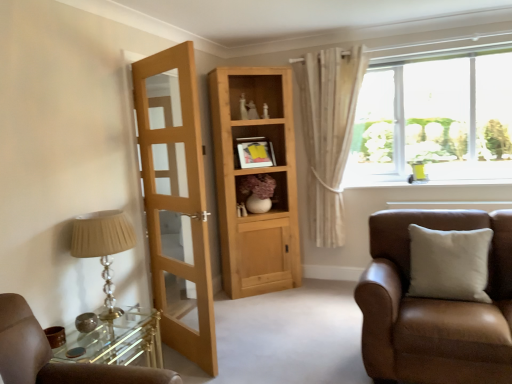
Question: Considering the relative sizes of light brown wooden door at left and white glossy window sill at upper right in the image provided, is light brown wooden door at left wider than white glossy window sill at upper right?

Choices:
 (A) no
 (B) yes

Answer: (A)

Question: Is light brown wooden door at left located outside white glossy window sill at upper right?

Choices:
 (A) yes
 (B) no

Answer: (A)

Question: Can you confirm if light brown wooden door at left is thinner than white glossy window sill at upper right?

Choices:
 (A) no
 (B) yes

Answer: (B)

Question: Is light brown wooden door at left facing towards white glossy window sill at upper right?

Choices:
 (A) no
 (B) yes

Answer: (A)

Question: Is light brown wooden door at left far away from white glossy window sill at upper right?

Choices:
 (A) no
 (B) yes

Answer: (B)

Question: From the image's perspective, is brown leather chair at right located above or below white glossy window sill at upper right?

Choices:
 (A) below
 (B) above

Answer: (A)

Question: From a real-world perspective, is brown leather chair at right physically located above or below white glossy window sill at upper right?

Choices:
 (A) below
 (B) above

Answer: (A)

Question: In terms of width, does brown leather chair at right look wider or thinner when compared to white glossy window sill at upper right?

Choices:
 (A) wide
 (B) thin

Answer: (A)

Question: Based on their sizes in the image, would you say brown leather chair at right is bigger or smaller than white glossy window sill at upper right?

Choices:
 (A) big
 (B) small

Answer: (A)

Question: In terms of height, does brown leather chair at right look taller or shorter compared to matte beige lampshade at left?

Choices:
 (A) short
 (B) tall

Answer: (B)

Question: From a real-world perspective, is brown leather chair at right positioned above or below matte beige lampshade at left?

Choices:
 (A) above
 (B) below

Answer: (B)

Question: Does point (395, 261) appear closer or farther from the camera than point (82, 256)?

Choices:
 (A) closer
 (B) farther

Answer: (B)

Question: From the image's perspective, is brown leather chair at right above or below matte beige lampshade at left?

Choices:
 (A) above
 (B) below

Answer: (B)

Question: Is light brown wooden door at left wider or thinner than brown leather chair at right?

Choices:
 (A) wide
 (B) thin

Answer: (B)

Question: Based on their sizes in the image, would you say light brown wooden door at left is bigger or smaller than brown leather chair at right?

Choices:
 (A) small
 (B) big

Answer: (A)